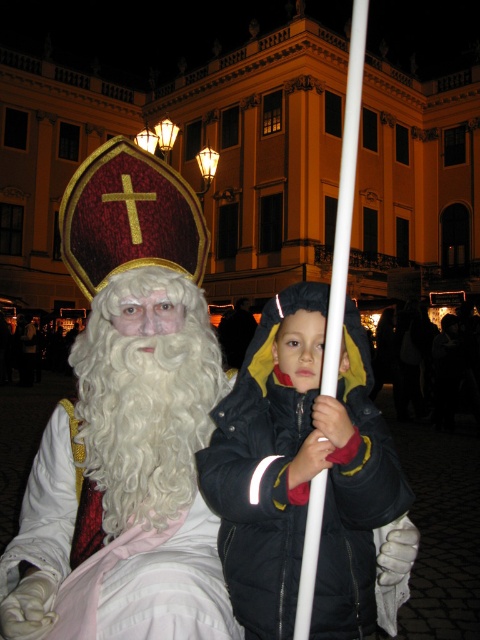
You are a photographer trying to capture a photo of the black puffy coat at center and the white plastic pole at center. If you want to ensure both are fully visible in the frame, which object should you adjust your focus towards to avoid cropping?

Since the black puffy coat at center has a lesser width compared to the white plastic pole at center, you should focus on the wider white plastic pole at center to ensure both fit in the frame without cropping.

You are standing in the public square and see the image. There is a point at coordinate [144,413]. What object is located at that point?

The point at coordinate [144,413] is located on the white curly beard at center.

You are a photographer trying to capture a clear shot of both the black puffy coat at center and the white plastic pole at center. Since you want both subjects to appear equally prominent in the photo, which one should you zoom in on more?

The black puffy coat at center is smaller than the white plastic pole at center, so you should zoom in more on the black puffy coat at center to make it appear larger and balance its prominence with the white plastic pole at center.